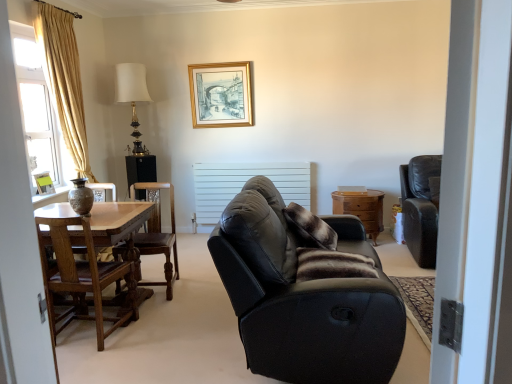
Question: From the image's perspective, is brown fur pillow at center, the first pillow viewed from the front, located above or below translucent glass window at left?

Choices:
 (A) below
 (B) above

Answer: (A)

Question: Considering the positions of brown fur pillow at center, the first pillow viewed from the front, and translucent glass window at left in the image, is brown fur pillow at center, the first pillow viewed from the front, taller or shorter than translucent glass window at left?

Choices:
 (A) tall
 (B) short

Answer: (B)

Question: Estimate the real-world distances between objects in this image. Which object is farther from the gold wooden picture frame at upper center, acting as the second picture frame starting from the left?

Choices:
 (A) white fabric lampshade at upper center
 (B) wooden chair at left, the third chair in the right-to-left sequence
 (C) matte black screen door at right
 (D) wooden side table at right
 (E) wooden polished chair at center left, positioned as the 2th chair in right-to-left order

Answer: (C)

Question: Which object is the farthest from the matte gold picture frame at left, marked as the first picture frame in a left-to-right arrangement?

Choices:
 (A) wooden chair at left, arranged as the 3th chair when viewed from the back
 (B) matte black screen door at right
 (C) matte brown vase at left
 (D) gold wooden picture frame at upper center, which is the first picture frame from right to left
 (E) translucent glass window at left

Answer: (B)